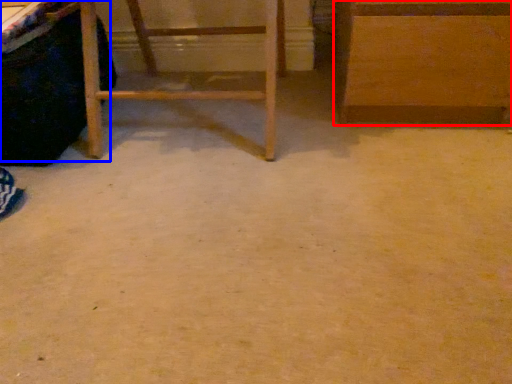
Question: Among these objects, which one is nearest to the camera, furniture (highlighted by a red box) or vanity (highlighted by a blue box)?

Choices:
 (A) furniture
 (B) vanity

Answer: (B)